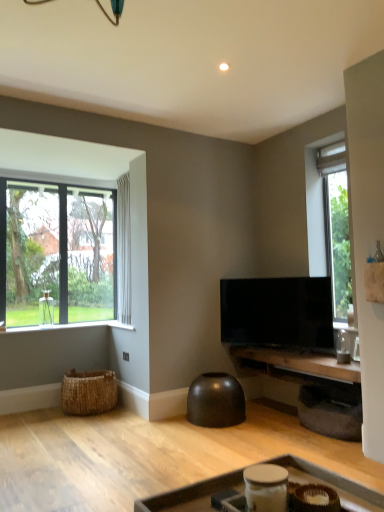
Question: From a real-world perspective, is wooden tray at lower center, marked as the 1th table in a front-to-back arrangement, located higher than clear glass window at left?

Choices:
 (A) no
 (B) yes

Answer: (A)

Question: Are wooden tray at lower center, marked as the 1th table in a front-to-back arrangement, and clear glass window at left far apart?

Choices:
 (A) no
 (B) yes

Answer: (B)

Question: Can you confirm if wooden tray at lower center, marked as the 1th table in a front-to-back arrangement, is smaller than clear glass window at left?

Choices:
 (A) no
 (B) yes

Answer: (B)

Question: Is wooden tray at lower center, marked as the 1th table in a front-to-back arrangement, positioned before clear glass window at left?

Choices:
 (A) no
 (B) yes

Answer: (B)

Question: Is wooden tray at lower center, marked as the 1th table in a front-to-back arrangement, next to clear glass window at left?

Choices:
 (A) no
 (B) yes

Answer: (A)

Question: From the image's perspective, is wooden tray at lower center, marked as the 1th table in a front-to-back arrangement, located beneath clear glass window at left?

Choices:
 (A) yes
 (B) no

Answer: (A)

Question: Is clear glass window at left outside wooden tray at lower center, marked as the 1th table in a front-to-back arrangement?

Choices:
 (A) yes
 (B) no

Answer: (A)

Question: Does clear glass window at left have a greater width compared to wooden tray at lower center, which is the 2th table in back-to-front order?

Choices:
 (A) no
 (B) yes

Answer: (A)

Question: Is clear glass window at left looking in the opposite direction of wooden tray at lower center, marked as the 1th table in a front-to-back arrangement?

Choices:
 (A) yes
 (B) no

Answer: (B)

Question: Is clear glass window at left closer to the viewer compared to wooden tray at lower center, which is the 2th table in back-to-front order?

Choices:
 (A) no
 (B) yes

Answer: (A)

Question: Is clear glass window at left in contact with wooden tray at lower center, marked as the 1th table in a front-to-back arrangement?

Choices:
 (A) yes
 (B) no

Answer: (B)

Question: Does clear glass window at left have a smaller size compared to wooden tray at lower center, which is the 2th table in back-to-front order?

Choices:
 (A) no
 (B) yes

Answer: (A)

Question: Is there a large distance between woven brown basket at lower left and clear glass window at left?

Choices:
 (A) yes
 (B) no

Answer: (A)